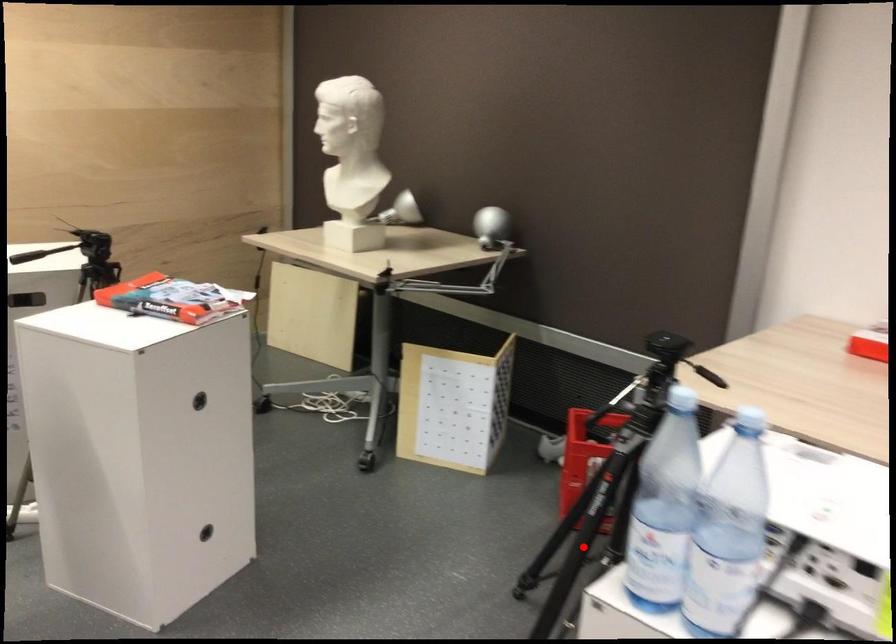
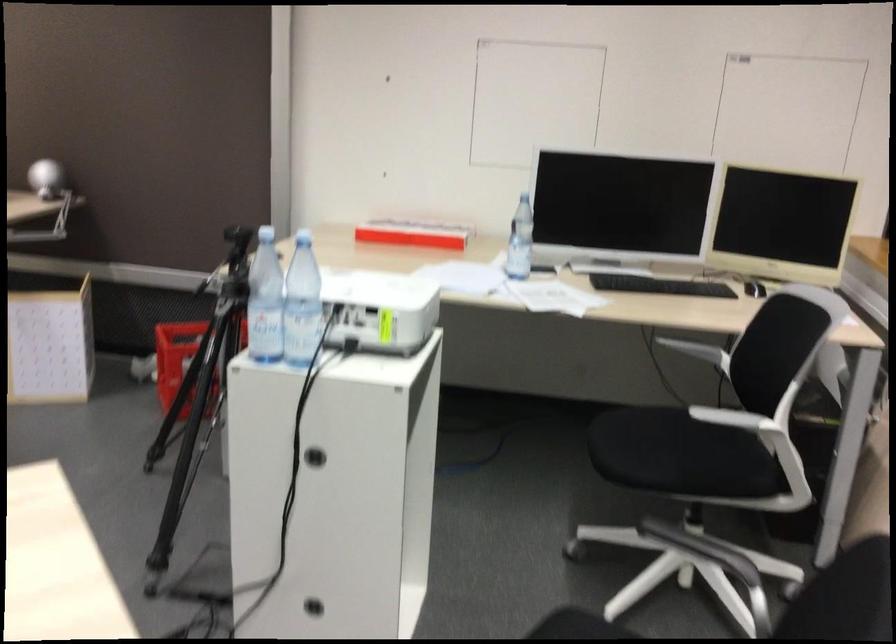
Question: I am providing you with two images of the same scene from different viewpoints. Image1 has a red point marked. In image2, the corresponding 3D location appears at what relative position? Reply with the corresponding letter.

Choices:
 (A) Closer
 (B) Farther

Answer: (B)